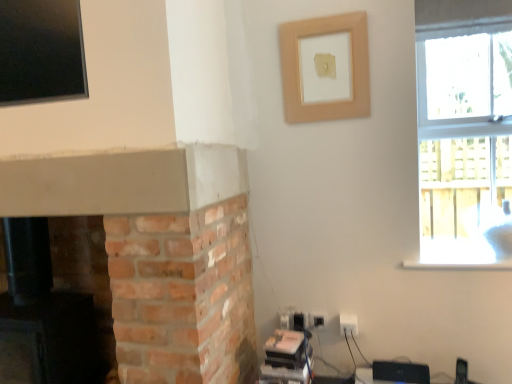
What is the approximate height of wooden frame at upper center?

wooden frame at upper center is 18.75 inches tall.

You are a GUI agent. You are given a task and a screenshot of the screen. Output one action in this format:
    pyautogui.click(x=<x>, y=<y>)
    Task: Click on the clear glass window at upper right
    This screenshot has height=384, width=512.
    Given the screenshot: What is the action you would take?
    (x=465, y=143)

From the picture: Measure the distance between point [353,331] and camera.

Point [353,331] is 2.08 meters from camera.

The height and width of the screenshot is (384, 512). What are the coordinates of `wooden frame at upper center` in the screenshot? It's located at (325, 68).

Does brick fireplace at lower left have a larger size compared to white plastic electric outlet at lower right?

Yes, brick fireplace at lower left is bigger than white plastic electric outlet at lower right.

Which is less distant, (49, 347) or (356, 324)?

The point (49, 347) is closer to the camera.

How many degrees apart are the facing directions of brick fireplace at lower left and white plastic electric outlet at lower right?

1.82 degrees separate the facing orientations of brick fireplace at lower left and white plastic electric outlet at lower right.

In terms of height, does brick fireplace at lower left look taller or shorter compared to white plastic electric outlet at lower right?

In the image, brick fireplace at lower left appears to be taller than white plastic electric outlet at lower right.

Is brick fireplace at lower left in front of wooden frame at upper center?

Yes.

From the picture: In the image, is brick fireplace at lower left on the left side or the right side of wooden frame at upper center?

From the image, it's evident that brick fireplace at lower left is to the left of wooden frame at upper center.

Are brick fireplace at lower left and wooden frame at upper center located far from each other?

brick fireplace at lower left is positioned a significant distance from wooden frame at upper center.

From the image's perspective, which one is positioned lower, brick fireplace at lower left or wooden frame at upper center?

brick fireplace at lower left appears lower in the image.

Is white plastic electric outlet at lower right placed right next to brick fireplace at lower left?

No, white plastic electric outlet at lower right is not beside brick fireplace at lower left.

Considering the sizes of white plastic electric outlet at lower right and brick fireplace at lower left in the image, is white plastic electric outlet at lower right bigger or smaller than brick fireplace at lower left?

white plastic electric outlet at lower right is smaller than brick fireplace at lower left.

Which is behind, white plastic electric outlet at lower right or brick fireplace at lower left?

white plastic electric outlet at lower right is more distant.

Can you confirm if white plastic electric outlet at lower right is shorter than brick fireplace at lower left?

Yes, white plastic electric outlet at lower right is shorter than brick fireplace at lower left.

Between white plastic electric outlet at lower right and wooden frame at upper center, which one has more height?

wooden frame at upper center.

From a real-world perspective, who is located higher, white plastic electric outlet at lower right or wooden frame at upper center?

wooden frame at upper center is physically above.

Does white plastic electric outlet at lower right appear on the left side of wooden frame at upper center?

No, white plastic electric outlet at lower right is not to the left of wooden frame at upper center.

The image size is (512, 384). I want to click on electric outlet below the wooden frame at upper center (from a real-world perspective), so click(348, 324).

Could you tell me if wooden frame at upper center is facing white plastic electric outlet at lower right?

No, wooden frame at upper center is not aimed at white plastic electric outlet at lower right.

Does wooden frame at upper center have a lesser width compared to white plastic electric outlet at lower right?

Indeed, wooden frame at upper center has a lesser width compared to white plastic electric outlet at lower right.

Can you confirm if wooden frame at upper center is shorter than white plastic electric outlet at lower right?

No, wooden frame at upper center is not shorter than white plastic electric outlet at lower right.

Is wooden frame at upper center not near white plastic electric outlet at lower right?

Yes, wooden frame at upper center and white plastic electric outlet at lower right are located far from each other.

Locate an element on the screen. The width and height of the screenshot is (512, 384). window that appears on the right of wooden frame at upper center is located at coordinates (465, 143).

From the image's perspective, is clear glass window at upper right positioned above or below wooden frame at upper center?

clear glass window at upper right is below wooden frame at upper center.

Which of these two, clear glass window at upper right or wooden frame at upper center, is wider?

clear glass window at upper right is wider.

Is white plastic electric outlet at lower right looking in the opposite direction of clear glass window at upper right?

white plastic electric outlet at lower right does not have its back to clear glass window at upper right.

Looking at this image, from the image's perspective, is white plastic electric outlet at lower right over clear glass window at upper right?

No, from the image's perspective, white plastic electric outlet at lower right is not on top of clear glass window at upper right.

Can you tell me how much white plastic electric outlet at lower right and clear glass window at upper right differ in facing direction?

The facing directions of white plastic electric outlet at lower right and clear glass window at upper right are 1.91 degrees apart.

The width and height of the screenshot is (512, 384). I want to click on fireplace on the left side of white plastic electric outlet at lower right, so click(x=49, y=321).

I want to click on fireplace below the wooden frame at upper center (from a real-world perspective), so click(49, 321).

Consider the image. Estimate the real-world distances between objects in this image. Which object is closer to white plastic electric outlet at lower right, wooden frame at upper center or brick fireplace at lower left?

wooden frame at upper center lies closer to white plastic electric outlet at lower right than the other object.

Based on the photo, which object lies further to the anchor point clear glass window at upper right, wooden frame at upper center or white plastic electric outlet at lower right?

Based on the image, white plastic electric outlet at lower right appears to be further to clear glass window at upper right.

Looking at the image, which one is located further to wooden frame at upper center, clear glass window at upper right or brick fireplace at lower left?

clear glass window at upper right lies further to wooden frame at upper center than the other object.

Looking at this image, which object lies further to the anchor point brick fireplace at lower left, clear glass window at upper right or wooden frame at upper center?

Based on the image, clear glass window at upper right appears to be further to brick fireplace at lower left.

From the image, which object appears to be nearer to brick fireplace at lower left, wooden frame at upper center or white plastic electric outlet at lower right?

Among the two, white plastic electric outlet at lower right is located nearer to brick fireplace at lower left.

Considering their positions, is brick fireplace at lower left positioned closer to white plastic electric outlet at lower right than wooden frame at upper center?

wooden frame at upper center is positioned closer to the anchor white plastic electric outlet at lower right.

Looking at the image, which one is located closer to clear glass window at upper right, white plastic electric outlet at lower right or wooden frame at upper center?

The object closer to clear glass window at upper right is wooden frame at upper center.

When comparing their distances from wooden frame at upper center, does white plastic electric outlet at lower right or brick fireplace at lower left seem closer?

white plastic electric outlet at lower right lies closer to wooden frame at upper center than the other object.

Identify the location of picture frame between brick fireplace at lower left and white plastic electric outlet at lower right from left to right. The image size is (512, 384). (325, 68).

The height and width of the screenshot is (384, 512). Find the location of `picture frame between brick fireplace at lower left and clear glass window at upper right in the horizontal direction`. picture frame between brick fireplace at lower left and clear glass window at upper right in the horizontal direction is located at coordinates (325, 68).

The height and width of the screenshot is (384, 512). Find the location of `window that lies between wooden frame at upper center and white plastic electric outlet at lower right from top to bottom`. window that lies between wooden frame at upper center and white plastic electric outlet at lower right from top to bottom is located at coordinates (465, 143).

Identify the location of electric outlet between brick fireplace at lower left and clear glass window at upper right from left to right. (348, 324).